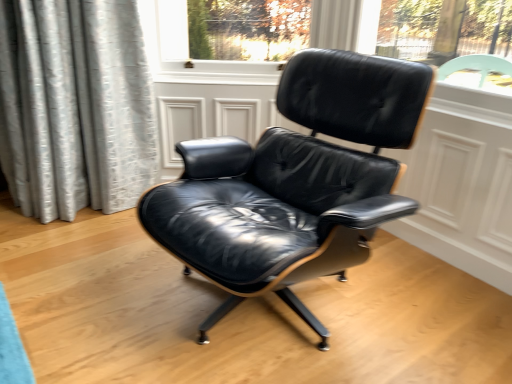
Question: Is black leather chair at center wider or thinner than black leather screen door at center?

Choices:
 (A) wide
 (B) thin

Answer: (A)

Question: Considering the positions of black leather chair at center and black leather screen door at center in the image, is black leather chair at center taller or shorter than black leather screen door at center?

Choices:
 (A) tall
 (B) short

Answer: (A)

Question: Considering the positions of black leather chair at center and black leather screen door at center in the image, is black leather chair at center bigger or smaller than black leather screen door at center?

Choices:
 (A) small
 (B) big

Answer: (B)

Question: Is black leather screen door at center wider or thinner than black leather chair at center?

Choices:
 (A) wide
 (B) thin

Answer: (B)

Question: From a real-world perspective, is black leather screen door at center positioned above or below black leather chair at center?

Choices:
 (A) above
 (B) below

Answer: (B)

Question: Considering their positions, is black leather screen door at center located in front of or behind black leather chair at center?

Choices:
 (A) front
 (B) behind

Answer: (B)

Question: Does point (200, 130) appear closer or farther from the camera than point (273, 283)?

Choices:
 (A) closer
 (B) farther

Answer: (B)